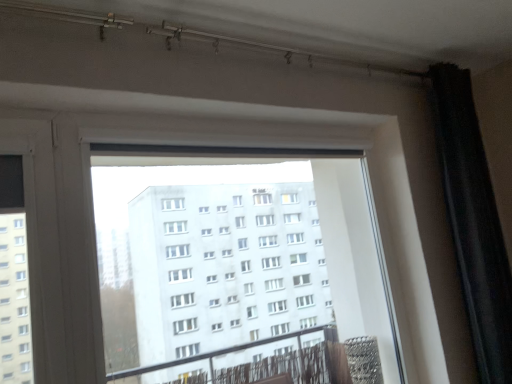
This screenshot has height=384, width=512. What do you see at coordinates (473, 221) in the screenshot?
I see `black fabric curtain at right` at bounding box center [473, 221].

What is the approximate width of black fabric curtain at right?

It is 9.06 inches.

This screenshot has height=384, width=512. I want to click on black fabric curtain at right, so click(x=473, y=221).

You are a GUI agent. You are given a task and a screenshot of the screen. Output one action in this format:
    pyautogui.click(x=<x>, y=<y>)
    Task: Click on the black fabric curtain at right
    
    Given the screenshot: What is the action you would take?
    pyautogui.click(x=473, y=221)